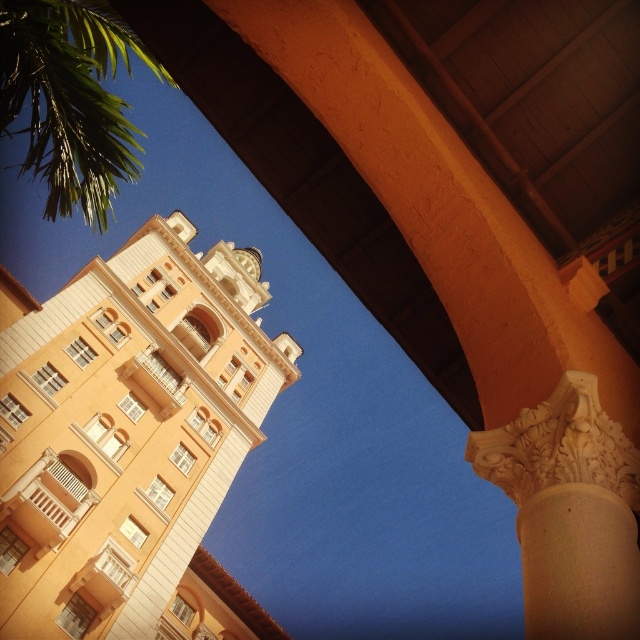
Between point (116, 336) and point (614, 568), which one is positioned in front?

Point (614, 568)

Who is more distant from viewer, (122,260) or (524,424)?

Point (122,260)

Between point (131, 321) and point (605, 604), which one is positioned in front?

Point (605, 604) is more forward.

Locate an element on the screen. matte orange bell tower at upper center is located at coordinates pyautogui.click(x=131, y=440).

Between matte orange bell tower at upper center and green leafy palm tree at upper left, which one appears on the left side from the viewer's perspective?

Positioned to the left is green leafy palm tree at upper left.

Does matte orange bell tower at upper center have a larger size compared to green leafy palm tree at upper left?

Incorrect, matte orange bell tower at upper center is not larger than green leafy palm tree at upper left.

Who is more distant from viewer, [200,432] or [49,88]?

Point [200,432]

Image resolution: width=640 pixels, height=640 pixels. I want to click on matte orange bell tower at upper center, so click(131, 440).

Does white carved stone column at center appear on the left side of green leafy palm tree at upper left?

No, white carved stone column at center is not to the left of green leafy palm tree at upper left.

Is point (484, 440) more distant than point (88, 28)?

No.

This screenshot has height=640, width=640. Find the location of `white carved stone column at center`. white carved stone column at center is located at coordinates (570, 512).